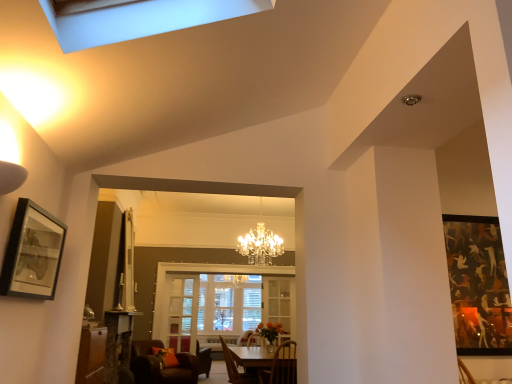
Question: Can you confirm if brown leather chair at lower left, the 3th chair positioned from the front, is thinner than matte black picture frame at left?

Choices:
 (A) yes
 (B) no

Answer: (B)

Question: Is brown leather chair at lower left, the 3th chair positioned from the front, beside matte black picture frame at left?

Choices:
 (A) no
 (B) yes

Answer: (A)

Question: Is brown leather chair at lower left, which is the 1th chair in back-to-front order, shorter than matte black picture frame at left?

Choices:
 (A) no
 (B) yes

Answer: (A)

Question: Is brown leather chair at lower left, which is the 1th chair in back-to-front order, positioned in front of matte black picture frame at left?

Choices:
 (A) yes
 (B) no

Answer: (B)

Question: Is brown leather chair at lower left, arranged as the third chair when viewed from the right, wider than matte black picture frame at left?

Choices:
 (A) yes
 (B) no

Answer: (A)

Question: Is brown leather chair at lower left, arranged as the third chair when viewed from the right, smaller than matte black picture frame at left?

Choices:
 (A) yes
 (B) no

Answer: (B)

Question: Is matte black picture frame at left facing towards wooden table at center?

Choices:
 (A) yes
 (B) no

Answer: (B)

Question: Can you see matte black picture frame at left touching wooden table at center?

Choices:
 (A) yes
 (B) no

Answer: (B)

Question: Is matte black picture frame at left closer to camera compared to wooden table at center?

Choices:
 (A) yes
 (B) no

Answer: (A)

Question: Considering the relative sizes of matte black picture frame at left and wooden table at center in the image provided, is matte black picture frame at left shorter than wooden table at center?

Choices:
 (A) no
 (B) yes

Answer: (B)

Question: Is matte black picture frame at left not close to wooden table at center?

Choices:
 (A) no
 (B) yes

Answer: (B)

Question: Can you confirm if matte black picture frame at left is positioned to the left of wooden table at center?

Choices:
 (A) yes
 (B) no

Answer: (A)

Question: Can you confirm if clear glass door at center is thinner than wooden chair at lower center, the 1th chair in the right-to-left sequence?

Choices:
 (A) no
 (B) yes

Answer: (B)